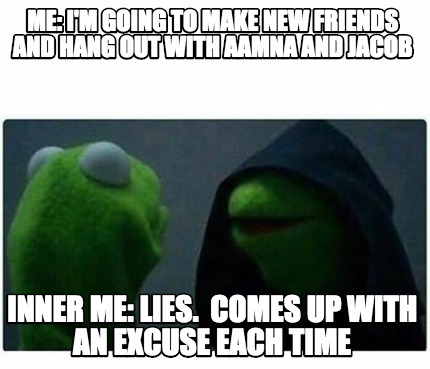
At what (x,y) coordinates should I click in order to perform the action: click on hood. Please return your answer as a coordinate pair (x, y). Looking at the image, I should click on (344, 211).